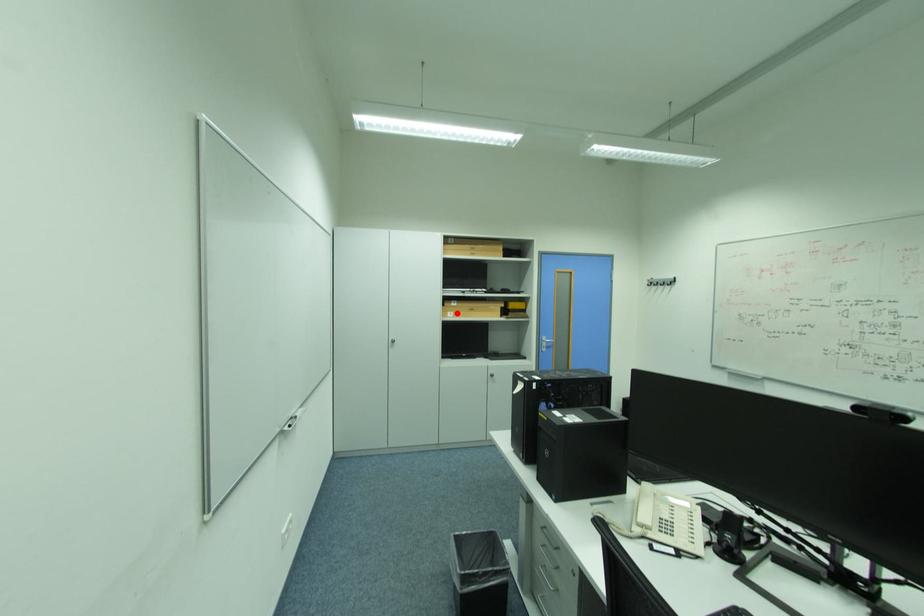
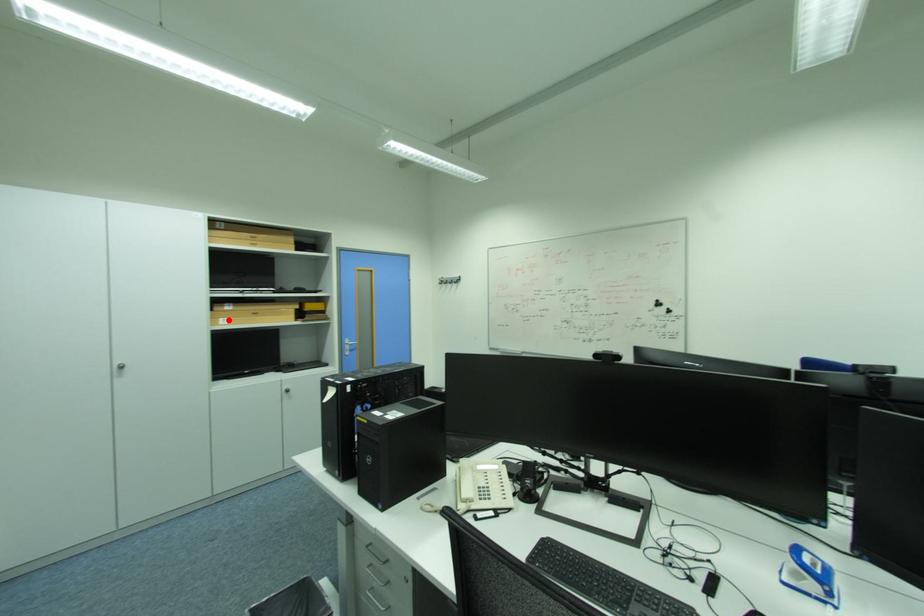
I am providing you with two images of the same scene from different viewpoints. A red point is marked on the first image and another point is marked on the second image. Is the marked point in image1 the same physical position as the marked point in image2?

Yes